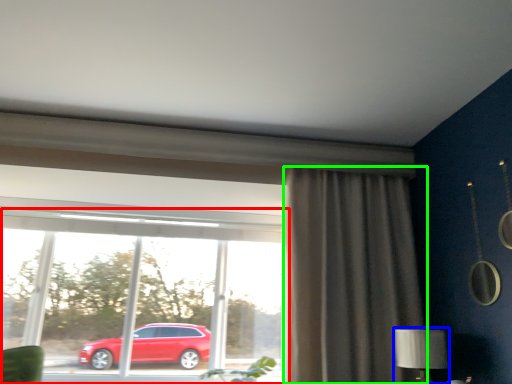
Question: Considering the real-world distances, which object is closest to window (highlighted by a red box)? table lamp (highlighted by a blue box) or curtain (highlighted by a green box).

Choices:
 (A) table lamp
 (B) curtain

Answer: (B)